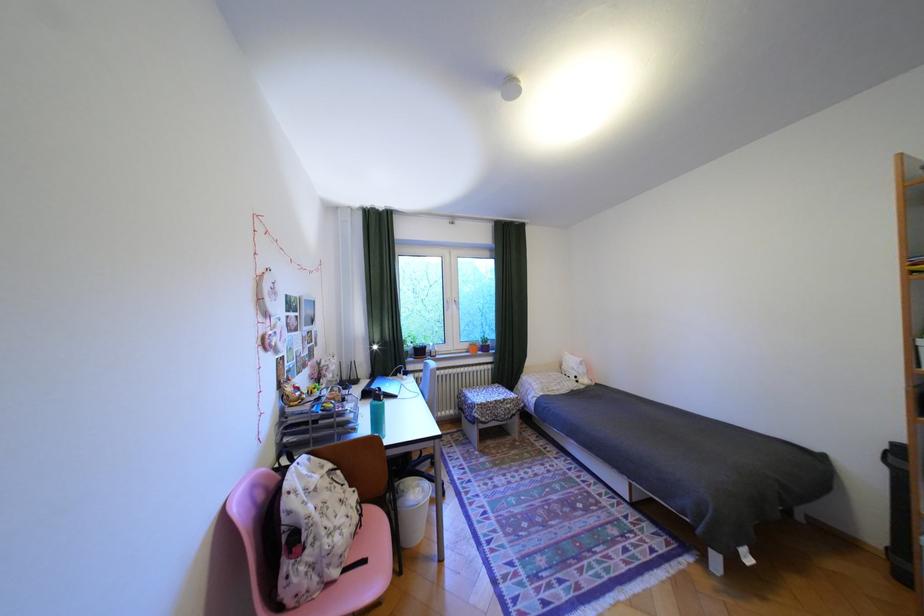
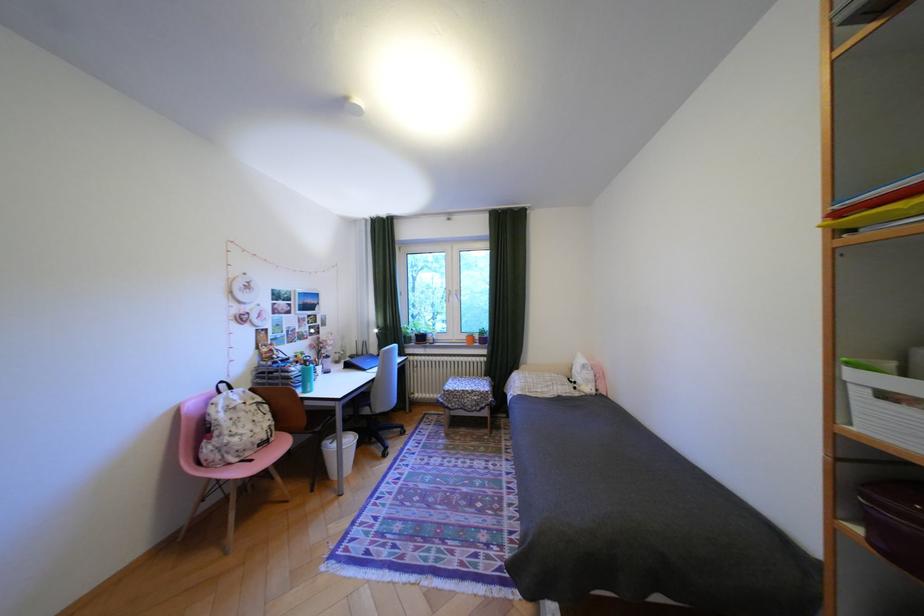
Question: Which direction would the cameraman need to move to produce the second image? Reply with the corresponding letter.

Choices:
 (A) Left
 (B) Right
 (C) Forward
 (D) Backward

Answer: (B)